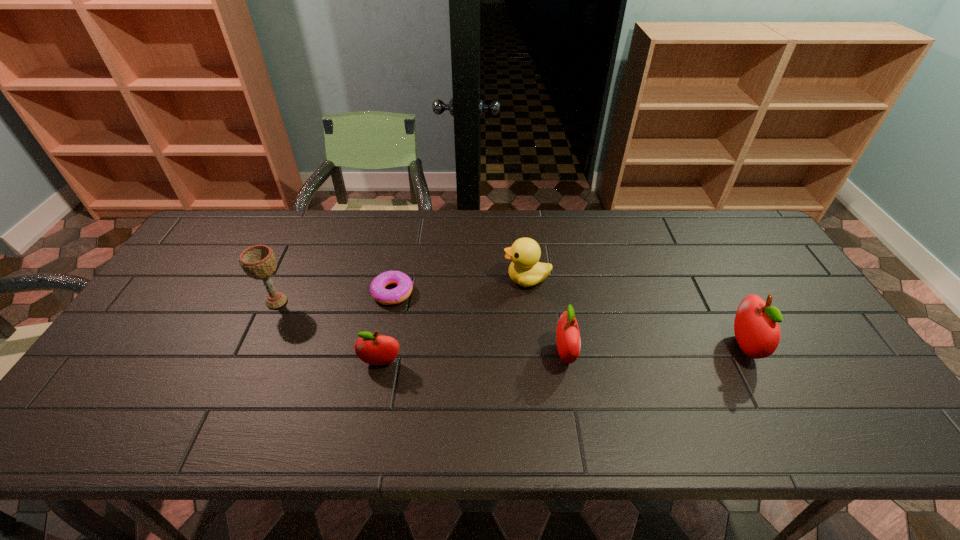
In the current image, all apples are evenly spaced. To maintain this equal spacing, where should an additional apple be placed on the left? Please point out a free spot. Please provide its 2D coordinates. Your answer should be formatted as a tuple, i.e. [(x, y)], where the tuple contains the x and y coordinates of a point satisfying the conditions above.

[(190, 372)]